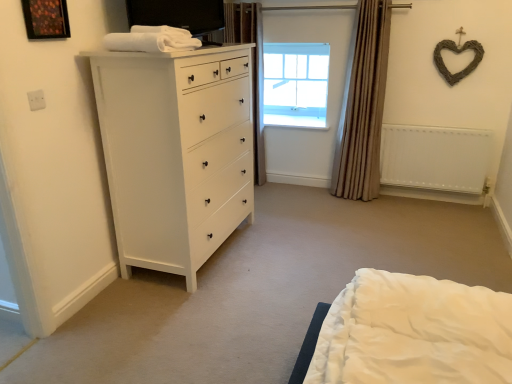
Question: Is beige fabric curtain at right, which is counted as the second curtain, starting from the left, directly adjacent to clear glass window at upper center?

Choices:
 (A) yes
 (B) no

Answer: (B)

Question: From a real-world perspective, is beige fabric curtain at right, which is counted as the second curtain, starting from the left, on clear glass window at upper center?

Choices:
 (A) no
 (B) yes

Answer: (A)

Question: Would you consider beige fabric curtain at right, which is counted as the second curtain, starting from the left, to be distant from clear glass window at upper center?

Choices:
 (A) yes
 (B) no

Answer: (B)

Question: Considering the relative positions of beige fabric curtain at right, the 1th curtain viewed from the right, and clear glass window at upper center in the image provided, is beige fabric curtain at right, the 1th curtain viewed from the right, in front of clear glass window at upper center?

Choices:
 (A) yes
 (B) no

Answer: (A)

Question: From a real-world perspective, does beige fabric curtain at right, the 1th curtain viewed from the right, sit lower than clear glass window at upper center?

Choices:
 (A) yes
 (B) no

Answer: (A)

Question: Considering the relative sizes of beige fabric curtain at right, which is counted as the second curtain, starting from the left, and clear glass window at upper center in the image provided, is beige fabric curtain at right, which is counted as the second curtain, starting from the left, thinner than clear glass window at upper center?

Choices:
 (A) no
 (B) yes

Answer: (A)

Question: Is wooden picture frame at upper left taller than beige fabric curtain at right, which is counted as the second curtain, starting from the left?

Choices:
 (A) yes
 (B) no

Answer: (B)

Question: From the image's perspective, is wooden picture frame at upper left beneath beige fabric curtain at right, the 1th curtain viewed from the right?

Choices:
 (A) yes
 (B) no

Answer: (B)

Question: Are wooden picture frame at upper left and beige fabric curtain at right, which is counted as the second curtain, starting from the left, making contact?

Choices:
 (A) no
 (B) yes

Answer: (A)

Question: Could beige fabric curtain at right, the 1th curtain viewed from the right, be considered to be inside wooden picture frame at upper left?

Choices:
 (A) yes
 (B) no

Answer: (B)

Question: Can you confirm if wooden picture frame at upper left is positioned to the right of beige fabric curtain at right, the 1th curtain viewed from the right?

Choices:
 (A) no
 (B) yes

Answer: (A)

Question: Considering the relative positions of wooden picture frame at upper left and beige fabric curtain at right, the 1th curtain viewed from the right, in the image provided, is wooden picture frame at upper left to the left of beige fabric curtain at right, the 1th curtain viewed from the right, from the viewer's perspective?

Choices:
 (A) yes
 (B) no

Answer: (A)

Question: Is white matte radiator at right oriented away from clear glass window at upper center?

Choices:
 (A) no
 (B) yes

Answer: (A)